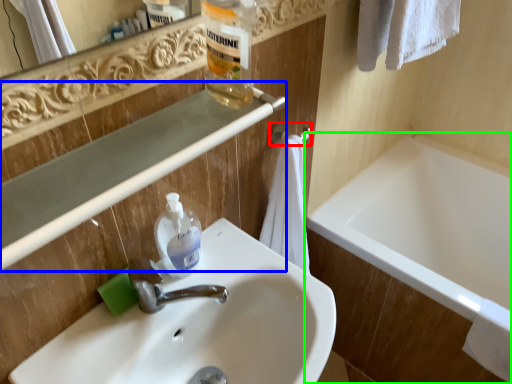
Question: Considering the real-world distances, which object is farthest from towel bar (highlighted by a red box)? balustrade (highlighted by a blue box) or bathtub (highlighted by a green box)?

Choices:
 (A) balustrade
 (B) bathtub

Answer: (B)